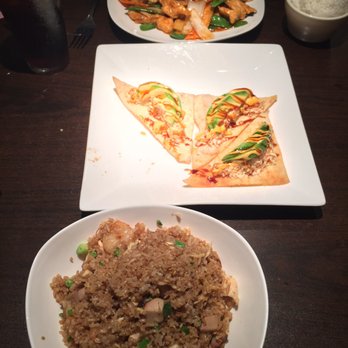
You are a GUI agent. You are given a task and a screenshot of the screen. Output one action in this format:
    pyautogui.click(x=<x>, y=<y>)
    Task: Click on the rounded plates
    The image size is (348, 348).
    Given the screenshot: What is the action you would take?
    pyautogui.click(x=129, y=24), pyautogui.click(x=52, y=249)